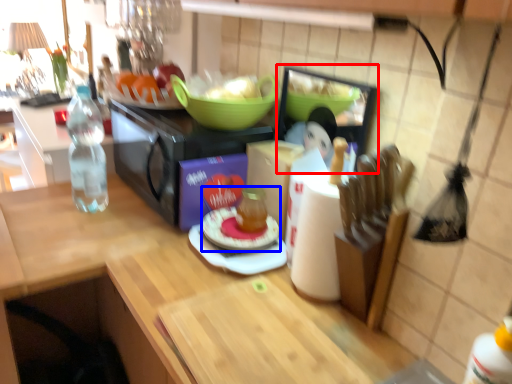
Question: Among these objects, which one is farthest to the camera, appliance (highlighted by a red box) or meal (highlighted by a blue box)?

Choices:
 (A) appliance
 (B) meal

Answer: (B)